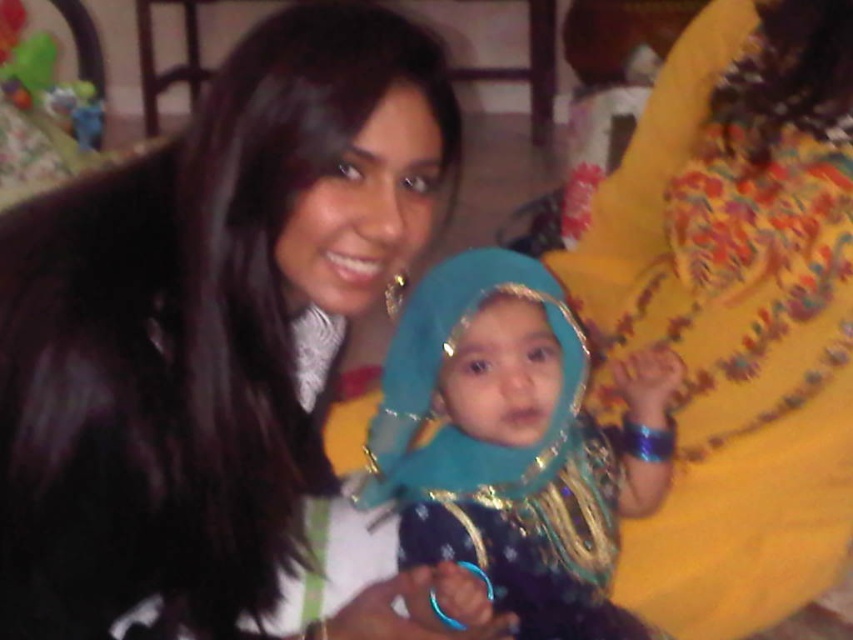
Can you confirm if black fur coat at center is positioned to the left of shiny blue fabric at center?

Yes, black fur coat at center is to the left of shiny blue fabric at center.

Does black fur coat at center have a larger size compared to shiny blue fabric at center?

Correct, black fur coat at center is larger in size than shiny blue fabric at center.

Is point (254, 349) closer to camera compared to point (520, 592)?

Yes.

Find the location of a particular element. Image resolution: width=853 pixels, height=640 pixels. black fur coat at center is located at coordinates (218, 344).

Which is more to the right, yellow embroidered dress at right or shiny blue fabric at center?

yellow embroidered dress at right is more to the right.

Can you confirm if yellow embroidered dress at right is bigger than shiny blue fabric at center?

Yes, yellow embroidered dress at right is bigger than shiny blue fabric at center.

Who is more distant from viewer, (793, 376) or (634, 360)?

The point (793, 376) is behind.

The width and height of the screenshot is (853, 640). I want to click on yellow embroidered dress at right, so click(x=734, y=314).

Can you confirm if black fur coat at center is positioned to the right of yellow embroidered dress at right?

In fact, black fur coat at center is to the left of yellow embroidered dress at right.

Is point (114, 456) farther from camera compared to point (718, 445)?

No, it is in front of (718, 445).

Locate an element on the screen. black fur coat at center is located at coordinates (218, 344).